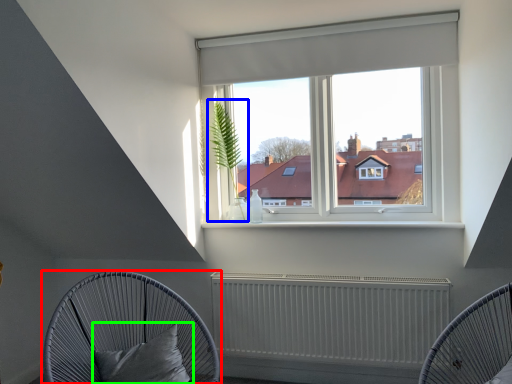
Question: Which is farther away from furniture (highlighted by a red box)? plant (highlighted by a blue box) or pillow (highlighted by a green box)?

Choices:
 (A) plant
 (B) pillow

Answer: (A)